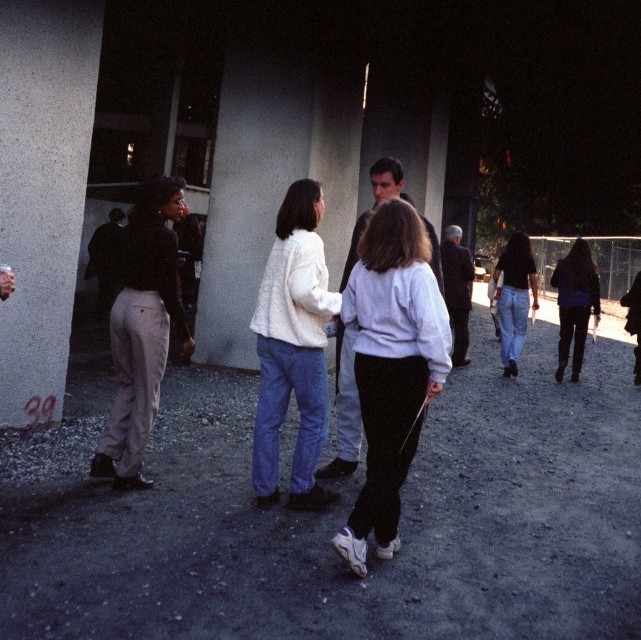
You are at the gathering and want to greet the person in the white sweater at center. Which direction should you walk to reach them relative to the smooth gray sweater at center?

The white sweater at center is to the left of the smooth gray sweater at center, so you should walk to the left side of the smooth gray sweater at center to reach them.

You are standing at the point labeled point (126, 372) and want to walk to the point labeled point (335, 461). Based on the scene description, which direction should you move to get closer to your destination?

You should move towards the background away from the viewer since point (335, 461) is further away than point (126, 372).